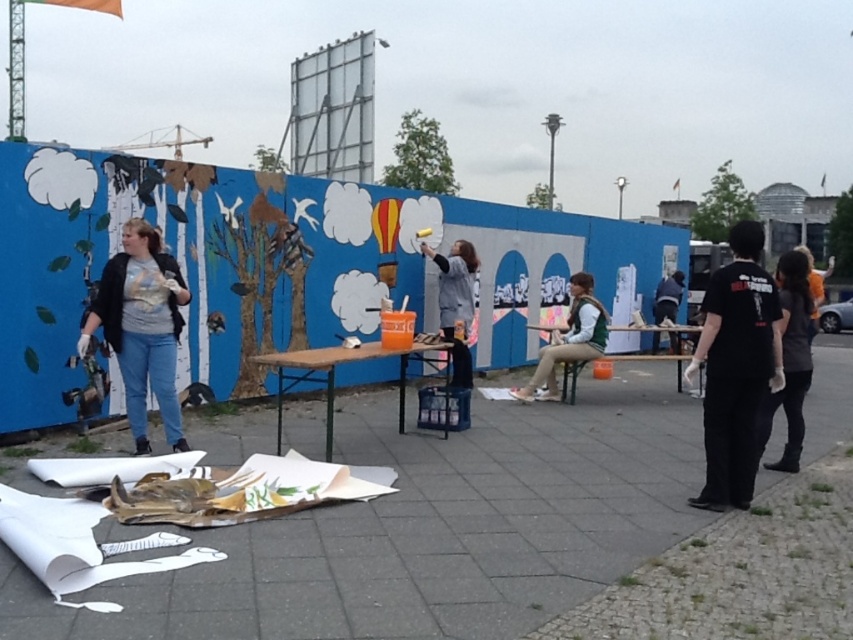
Can you confirm if matte gray shirt at left is positioned to the right of dark gray shirt at right?

No, matte gray shirt at left is not to the right of dark gray shirt at right.

Does matte gray shirt at left come behind dark gray shirt at right?

No, matte gray shirt at left is closer to the viewer.

Who is more forward, (120, 337) or (788, 294)?

Point (120, 337) is in front.

The width and height of the screenshot is (853, 640). I want to click on matte gray shirt at left, so click(x=141, y=326).

Is point (737, 433) less distant than point (126, 291)?

That is True.

Does point (753, 412) come closer to viewer compared to point (164, 257)?

Yes, point (753, 412) is in front of point (164, 257).

Find the location of a particular element. black matte shirt at right is located at coordinates (735, 368).

Does black matte shirt at right have a greater height compared to green textured vest at center?

Incorrect, black matte shirt at right's height is not larger of green textured vest at center's.

Who is taller, black matte shirt at right or green textured vest at center?

green textured vest at center is taller.

The height and width of the screenshot is (640, 853). I want to click on black matte shirt at right, so click(x=735, y=368).